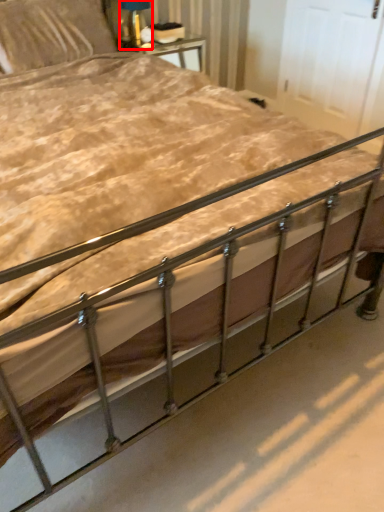
Question: Considering the relative positions of table lamp (annotated by the red box) and pillow in the image provided, where is table lamp (annotated by the red box) located with respect to the staircase?

Choices:
 (A) right
 (B) left

Answer: (A)